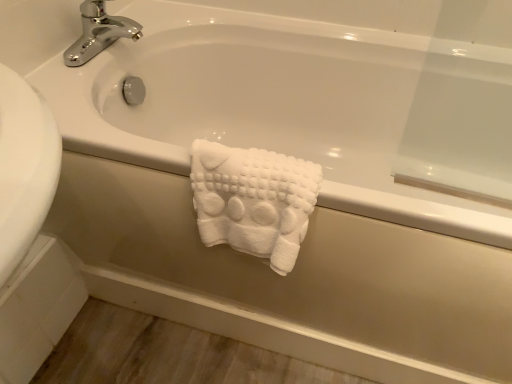
Question: Should I look upward or downward to see white fluffy towel at center?

Choices:
 (A) down
 (B) up

Answer: (A)

Question: From a real-world perspective, is chrome/metallic faucet at upper left over white fluffy towel at center?

Choices:
 (A) no
 (B) yes

Answer: (B)

Question: Is chrome/metallic faucet at upper left at the left side of white fluffy towel at center?

Choices:
 (A) yes
 (B) no

Answer: (A)

Question: From the image's perspective, does chrome/metallic faucet at upper left appear higher than white fluffy towel at center?

Choices:
 (A) yes
 (B) no

Answer: (A)

Question: Is the depth of chrome/metallic faucet at upper left greater than that of white fluffy towel at center?

Choices:
 (A) no
 (B) yes

Answer: (B)

Question: Is chrome/metallic faucet at upper left in front of white fluffy towel at center?

Choices:
 (A) yes
 (B) no

Answer: (B)

Question: Is chrome/metallic faucet at upper left facing away from white fluffy towel at center?

Choices:
 (A) yes
 (B) no

Answer: (B)

Question: Can you see white fluffy towel at center touching chrome/metallic faucet at upper left?

Choices:
 (A) no
 (B) yes

Answer: (A)

Question: From a real-world perspective, is white fluffy towel at center below chrome/metallic faucet at upper left?

Choices:
 (A) no
 (B) yes

Answer: (B)

Question: Is white fluffy towel at center to the left of chrome/metallic faucet at upper left from the viewer's perspective?

Choices:
 (A) no
 (B) yes

Answer: (A)

Question: From the image's perspective, does white fluffy towel at center appear lower than chrome/metallic faucet at upper left?

Choices:
 (A) yes
 (B) no

Answer: (A)

Question: Is chrome/metallic faucet at upper left a part of white fluffy towel at center?

Choices:
 (A) yes
 (B) no

Answer: (B)

Question: Is white fluffy towel at center positioned with its back to chrome/metallic faucet at upper left?

Choices:
 (A) yes
 (B) no

Answer: (B)

Question: From the image's perspective, is white fluffy towel at center positioned above or below chrome/metallic faucet at upper left?

Choices:
 (A) below
 (B) above

Answer: (A)